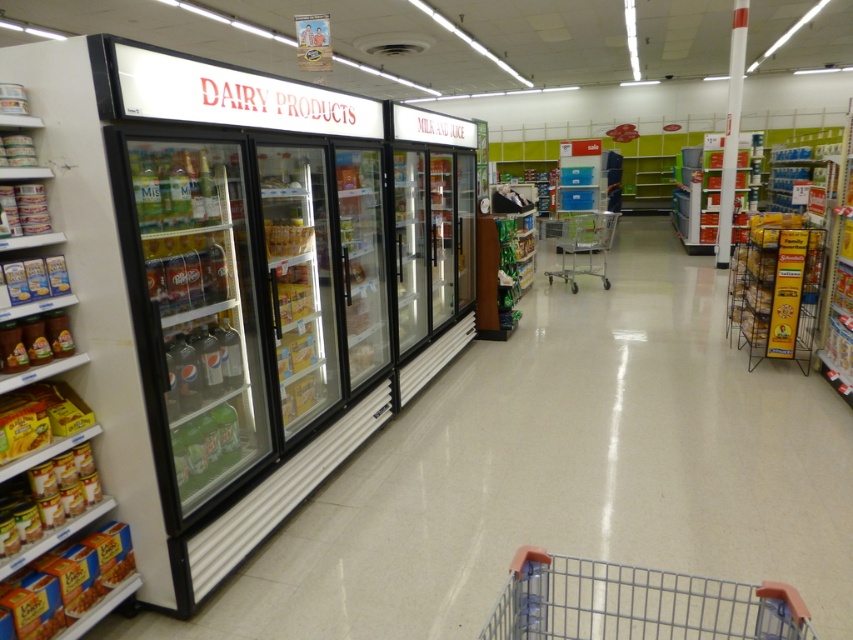
You are a delivery person who needs to place two items at specific coordinates in the grocery store. The first item must be placed at point (x=15, y=468), and the second at point (x=59, y=310). If you start at the entrance of the dairy section, which direction should you move first to reach the first point before the second?

Since point (x=15, y=468) is in front of point (x=59, y=310), you should move towards the first point by going forward from the entrance of the dairy section. After placing the first item, you can then move backward to reach the second point at (x=59, y=310).

You are a customer in the grocery store and want to grab the translucent plastic juice at center. Can you easily reach it without moving the metallic silver shopping cart at center?

The metallic silver shopping cart at center is much taller than the translucent plastic juice at center, so it might block your view or access to the juice. Move the cart to reach the juice.

You are organizing the grocery store shelves. You have a new shipment of items that need to be placed on the white plastic shelves at left and the translucent plastic juice at center. Based on their sizes, which object has a greater width?

The white plastic shelves at left have a greater width than the translucent plastic juice at center according to the description.